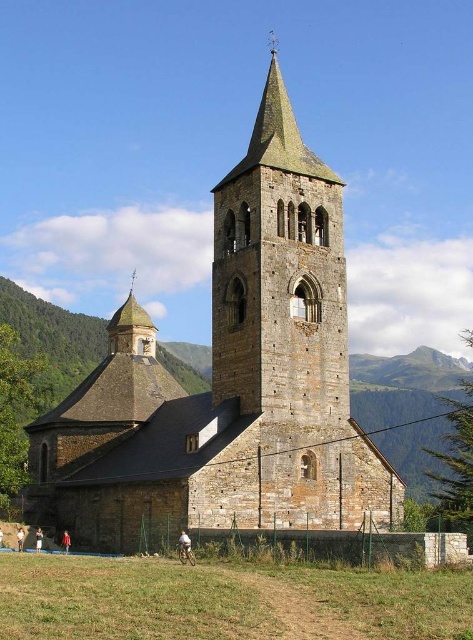
Question: Does brown stone church at center appear under smooth stone spire at upper left?

Choices:
 (A) no
 (B) yes

Answer: (A)

Question: Which object appears closest to the camera in this image?

Choices:
 (A) smooth stone spire at upper left
 (B) brown stone church at center

Answer: (B)

Question: Which point is farther from the camera taking this photo?

Choices:
 (A) (255, 234)
 (B) (132, 339)

Answer: (B)

Question: From the image, what is the correct spatial relationship of brown stone church at center in relation to smooth stone spire at upper left?

Choices:
 (A) right
 (B) left

Answer: (A)

Question: Considering the relative positions of brown stone church at center and smooth stone spire at upper left in the image provided, where is brown stone church at center located with respect to smooth stone spire at upper left?

Choices:
 (A) right
 (B) left

Answer: (A)